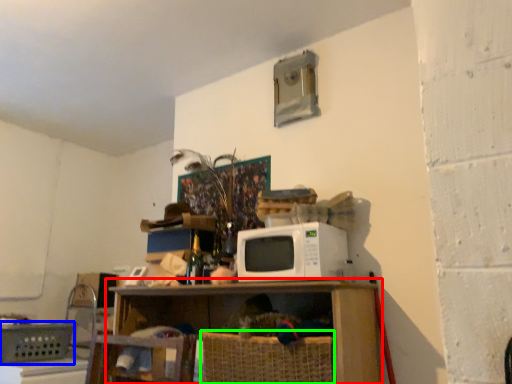
Question: Estimate the real-world distances between objects in this image. Which object is farther from shelf (highlighted by a red box), basket (highlighted by a blue box) or basket (highlighted by a green box)?

Choices:
 (A) basket
 (B) basket

Answer: (A)